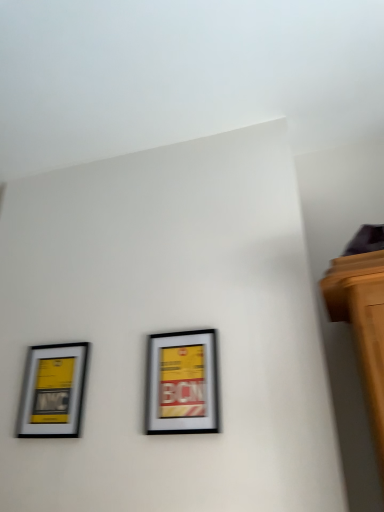
Question: Is matte black picture frame at left, arranged as the 1th picture frame when viewed from the left, at the left side of matte silver picture frame at center, which appears as the 2th picture frame when viewed from the left?

Choices:
 (A) yes
 (B) no

Answer: (A)

Question: Can you confirm if matte black picture frame at left, the second picture frame viewed from the right, is wider than matte silver picture frame at center, which appears as the 2th picture frame when viewed from the left?

Choices:
 (A) yes
 (B) no

Answer: (B)

Question: Is matte black picture frame at left, the second picture frame viewed from the right, shorter than matte silver picture frame at center, positioned as the 1th picture frame in right-to-left order?

Choices:
 (A) no
 (B) yes

Answer: (B)

Question: Is the position of matte black picture frame at left, arranged as the 1th picture frame when viewed from the left, more distant than that of matte silver picture frame at center, which appears as the 2th picture frame when viewed from the left?

Choices:
 (A) yes
 (B) no

Answer: (A)

Question: Does matte black picture frame at left, arranged as the 1th picture frame when viewed from the left, turn towards matte silver picture frame at center, which appears as the 2th picture frame when viewed from the left?

Choices:
 (A) yes
 (B) no

Answer: (B)

Question: Does matte black picture frame at left, arranged as the 1th picture frame when viewed from the left, have a larger size compared to matte silver picture frame at center, which appears as the 2th picture frame when viewed from the left?

Choices:
 (A) yes
 (B) no

Answer: (A)

Question: Does matte silver picture frame at center, positioned as the 1th picture frame in right-to-left order, have a greater width compared to matte black picture frame at left, the second picture frame viewed from the right?

Choices:
 (A) no
 (B) yes

Answer: (B)

Question: Is matte silver picture frame at center, positioned as the 1th picture frame in right-to-left order, further to the viewer compared to matte black picture frame at left, the second picture frame viewed from the right?

Choices:
 (A) yes
 (B) no

Answer: (B)

Question: Considering the relative sizes of matte silver picture frame at center, which appears as the 2th picture frame when viewed from the left, and matte black picture frame at left, arranged as the 1th picture frame when viewed from the left, in the image provided, is matte silver picture frame at center, which appears as the 2th picture frame when viewed from the left, taller than matte black picture frame at left, arranged as the 1th picture frame when viewed from the left,?

Choices:
 (A) yes
 (B) no

Answer: (A)

Question: From a real-world perspective, is matte silver picture frame at center, which appears as the 2th picture frame when viewed from the left, over matte black picture frame at left, the second picture frame viewed from the right?

Choices:
 (A) no
 (B) yes

Answer: (A)

Question: Is the surface of matte silver picture frame at center, which appears as the 2th picture frame when viewed from the left, in direct contact with matte black picture frame at left, the second picture frame viewed from the right?

Choices:
 (A) no
 (B) yes

Answer: (A)

Question: Considering the relative sizes of matte silver picture frame at center, positioned as the 1th picture frame in right-to-left order, and matte black picture frame at left, the second picture frame viewed from the right, in the image provided, is matte silver picture frame at center, positioned as the 1th picture frame in right-to-left order, thinner than matte black picture frame at left, the second picture frame viewed from the right,?

Choices:
 (A) no
 (B) yes

Answer: (A)

Question: Is matte black picture frame at left, arranged as the 1th picture frame when viewed from the left, taller or shorter than matte silver picture frame at center, positioned as the 1th picture frame in right-to-left order?

Choices:
 (A) tall
 (B) short

Answer: (B)